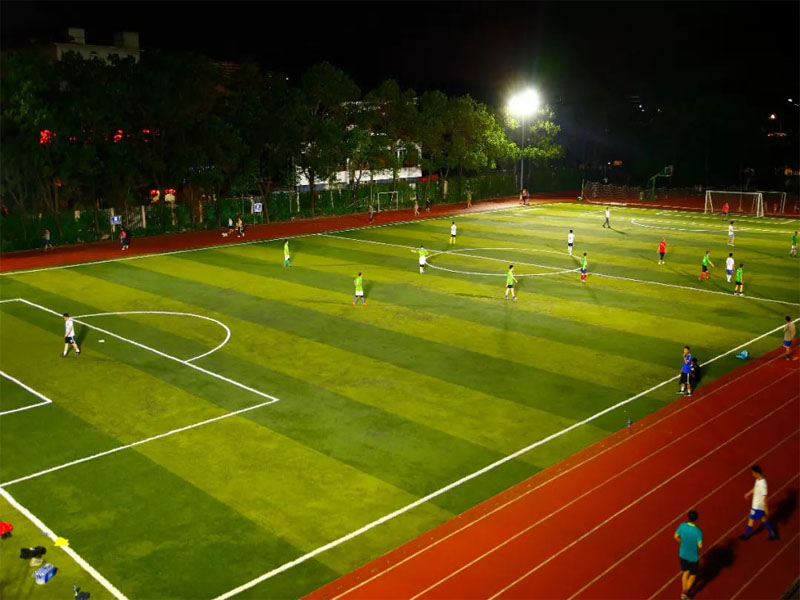
Where is `lights`? The width and height of the screenshot is (800, 600). lights is located at coordinates (522, 105).